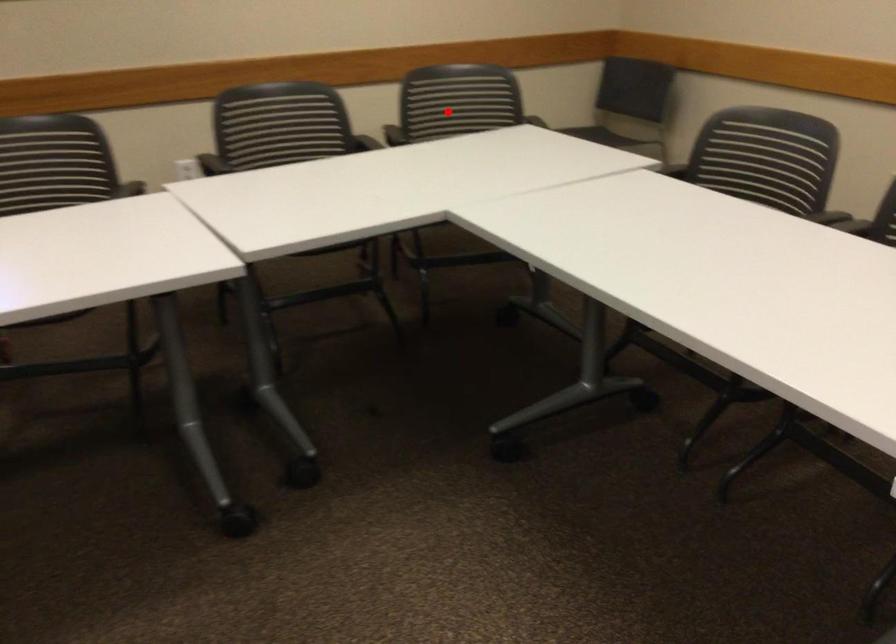
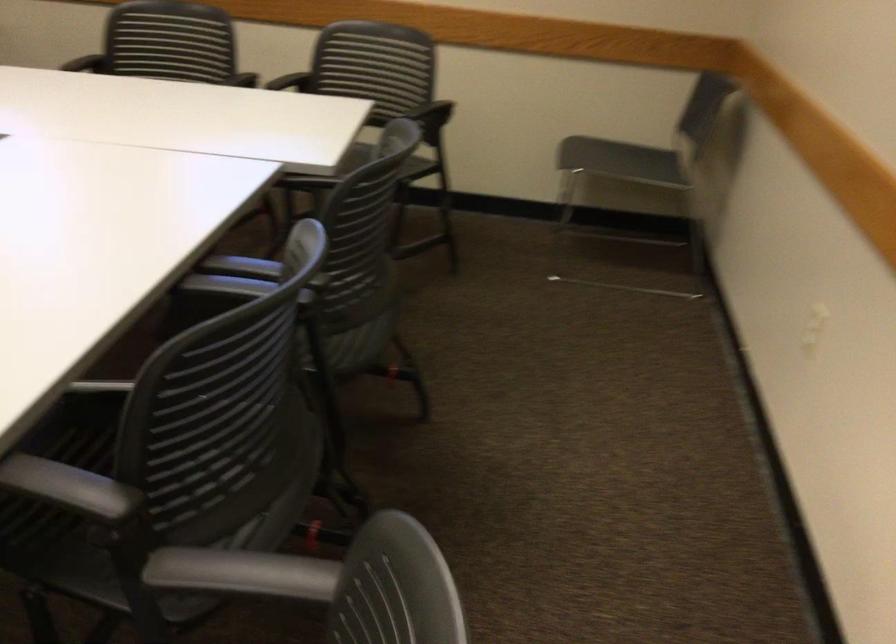
Question: I am providing you with two images of the same scene from different viewpoints. In image1, a red point is highlighted. Considering the same 3D point in image2, which of the following is correct?

Choices:
 (A) It is closer
 (B) It is farther

Answer: (A)